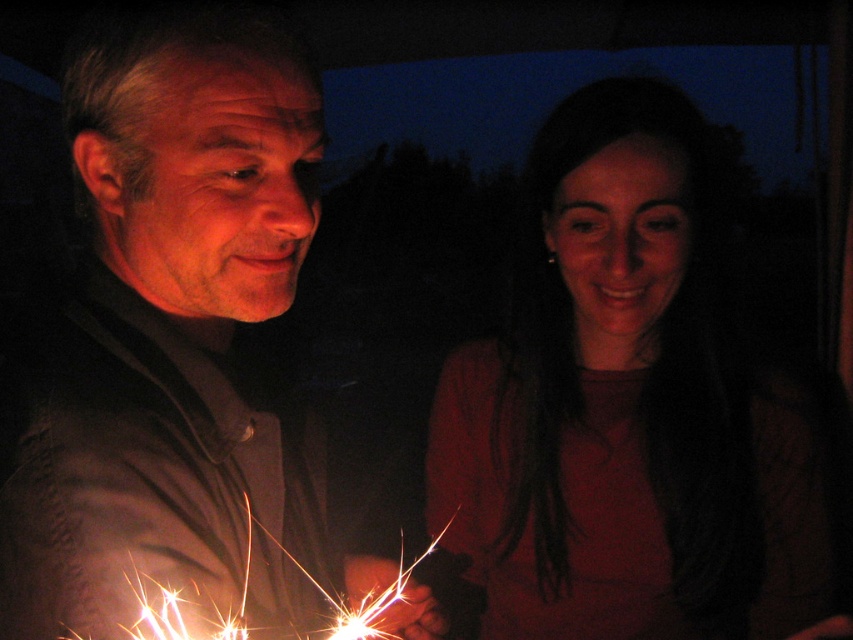
Question: Is matte black shirt at left to the left of matte red shirt at center from the viewer's perspective?

Choices:
 (A) no
 (B) yes

Answer: (B)

Question: Which object is farther from the camera taking this photo?

Choices:
 (A) matte black shirt at left
 (B) matte red shirt at center

Answer: (B)

Question: Does matte black shirt at left have a smaller size compared to matte red shirt at center?

Choices:
 (A) yes
 (B) no

Answer: (A)

Question: Can you confirm if matte black shirt at left is positioned above matte red shirt at center?

Choices:
 (A) no
 (B) yes

Answer: (B)